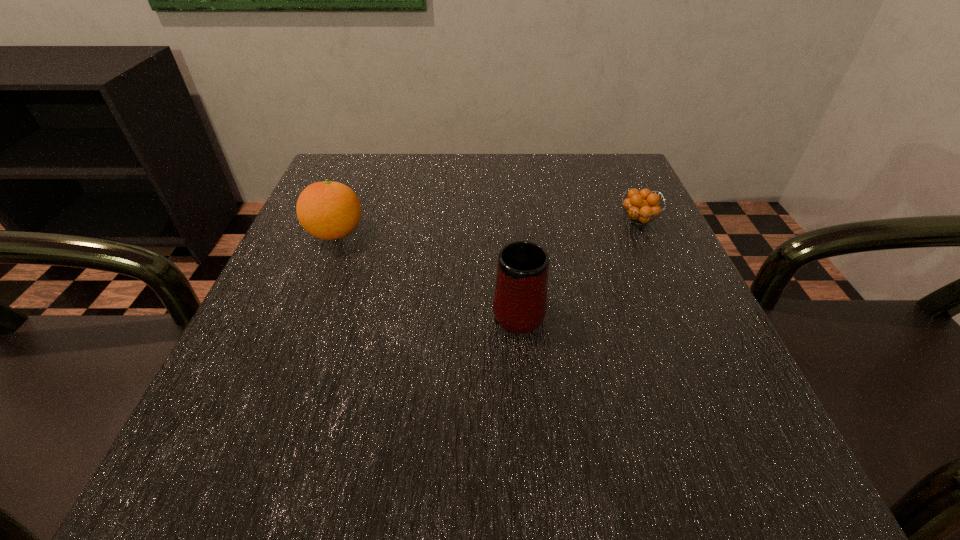
The width and height of the screenshot is (960, 540). Find the location of `vacant space at the near left corner of the desktop`. vacant space at the near left corner of the desktop is located at coordinates (301, 458).

I want to click on vacant space at the far right corner of the desktop, so click(624, 188).

In the image, there is a desktop. Where is `blank space at the near right corner`? The image size is (960, 540). blank space at the near right corner is located at coordinates (744, 485).

Locate an element on the screen. free space between the shortest object and the second object from left to right is located at coordinates (579, 264).

The height and width of the screenshot is (540, 960). I want to click on blank region between the nearest object and the taller orange fruit, so click(427, 271).

In order to click on free space between the right orange fruit and the mug in this screenshot , I will do `click(579, 264)`.

Where is `vacant space that's between the mug and the rightmost object`? vacant space that's between the mug and the rightmost object is located at coordinates (579, 264).

You are a GUI agent. You are given a task and a screenshot of the screen. Output one action in this format:
    pyautogui.click(x=<x>, y=<y>)
    Task: Click on the free spot between the left orange fruit and the shorter orange fruit
    This screenshot has width=960, height=540.
    Given the screenshot: What is the action you would take?
    pyautogui.click(x=488, y=227)

Where is `vacant area that lies between the taller orange fruit and the shorter orange fruit`? The image size is (960, 540). vacant area that lies between the taller orange fruit and the shorter orange fruit is located at coordinates (488, 227).

You are a GUI agent. You are given a task and a screenshot of the screen. Output one action in this format:
    pyautogui.click(x=<x>, y=<y>)
    Task: Click on the vacant area that lies between the taller orange fruit and the mug
    The width and height of the screenshot is (960, 540).
    Given the screenshot: What is the action you would take?
    pyautogui.click(x=427, y=271)